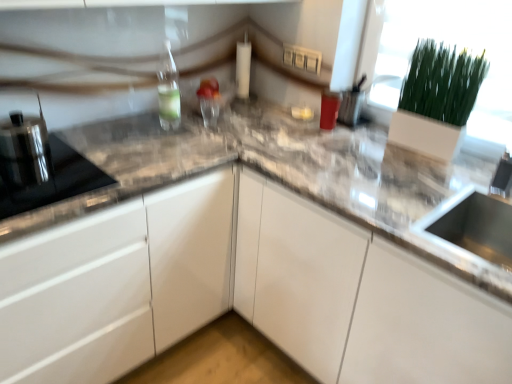
Locate an element on the screen. This screenshot has height=384, width=512. free space behind satin black kettle at left, marked as the first appliance in a left-to-right arrangement is located at coordinates (69, 138).